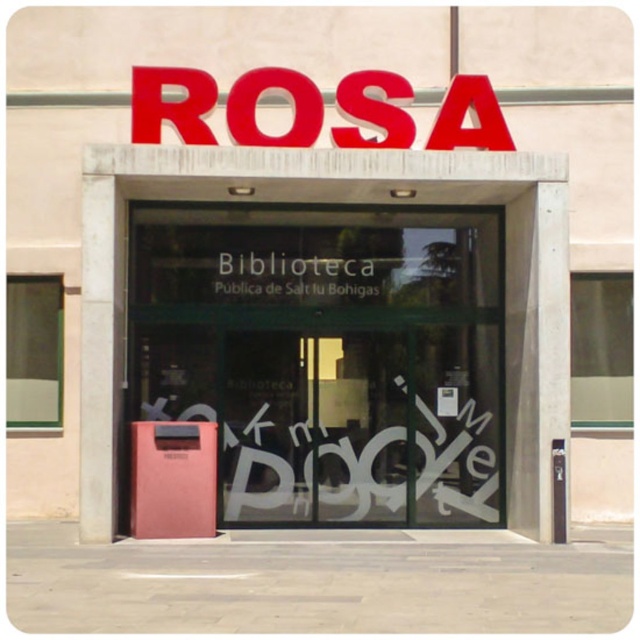
You are a delivery person trying to park your bike. The bike requires 1 meter of space to park. Is there enough space between the pink matte trash can at center and the black glass sign at center?

The distance between the pink matte trash can at center and the black glass sign at center is 71.94 centimeters, which is less than 1 meter. Therefore, there is not enough space to park the bike between them.

You are a delivery person approaching the library entrance. You need to place a package on the pink matte trash can at center and the black glass sign at center. Which object is closer to you as you approach the entrance?

The pink matte trash can at center is closer to you as you approach the entrance because it is in front of the black glass sign at center.

You are standing at the entrance of the Biblioteca P?blica de Salt la Bohigas and want to locate two specific points marked on the pavement. The first point is at coordinate (356,230) and the second at (376,275). Which point is closer to you?

The point at coordinate (356,230) is closer to you because it is further to the viewer than the other point.